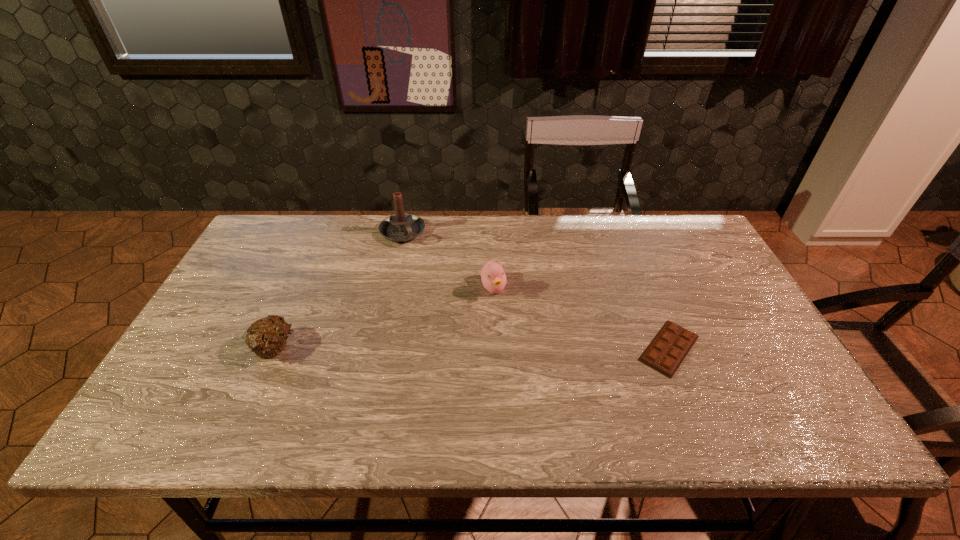
This screenshot has width=960, height=540. What are the coordinates of `vacant spot on the desktop that is between the muffin and the shortest object and is positioned on the front-facing side of the duckling` in the screenshot? It's located at (520, 348).

I want to click on free space on the desktop that is between the second shortest object and the chocolate bar and is positioned on the side of the tallest object with the handle loop, so click(473, 348).